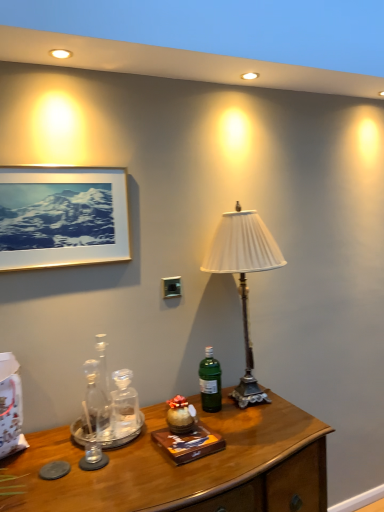
Question: From the image's perspective, is wooden desk at lower center over white pleated fabric lampshade at center?

Choices:
 (A) yes
 (B) no

Answer: (B)

Question: From a real-world perspective, is wooden desk at lower center on white pleated fabric lampshade at center?

Choices:
 (A) yes
 (B) no

Answer: (B)

Question: Can you confirm if wooden desk at lower center is taller than white pleated fabric lampshade at center?

Choices:
 (A) yes
 (B) no

Answer: (B)

Question: Is wooden desk at lower center positioned beyond the bounds of white pleated fabric lampshade at center?

Choices:
 (A) no
 (B) yes

Answer: (B)

Question: From a real-world perspective, is wooden desk at lower center located beneath white pleated fabric lampshade at center?

Choices:
 (A) no
 (B) yes

Answer: (B)

Question: Would you consider wooden desk at lower center to be distant from white pleated fabric lampshade at center?

Choices:
 (A) no
 (B) yes

Answer: (A)

Question: Is gold-framed picture at upper left outside wooden desk at lower center?

Choices:
 (A) no
 (B) yes

Answer: (B)

Question: Is gold-framed picture at upper left positioned behind wooden desk at lower center?

Choices:
 (A) yes
 (B) no

Answer: (A)

Question: Considering the relative sizes of gold-framed picture at upper left and wooden desk at lower center in the image provided, is gold-framed picture at upper left wider than wooden desk at lower center?

Choices:
 (A) no
 (B) yes

Answer: (A)

Question: Would you consider gold-framed picture at upper left to be distant from wooden desk at lower center?

Choices:
 (A) yes
 (B) no

Answer: (B)

Question: Can you confirm if gold-framed picture at upper left is positioned to the right of wooden desk at lower center?

Choices:
 (A) no
 (B) yes

Answer: (A)

Question: Is gold-framed picture at upper left looking in the opposite direction of wooden desk at lower center?

Choices:
 (A) yes
 (B) no

Answer: (B)

Question: From the image's perspective, is gold-framed picture at upper left located beneath green glass bottle at center?

Choices:
 (A) no
 (B) yes

Answer: (A)